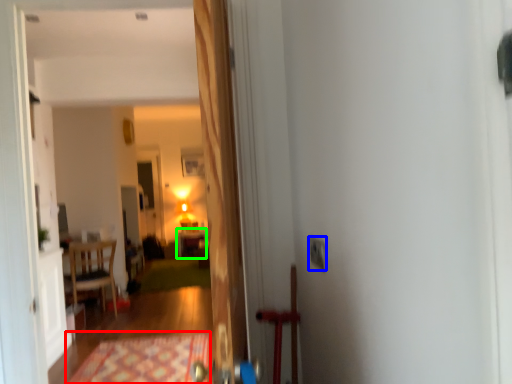
Question: Considering the real-world distances, which object is farthest from doormat (highlighted by a red box)? electric outlet (highlighted by a blue box) or table (highlighted by a green box)?

Choices:
 (A) electric outlet
 (B) table

Answer: (B)